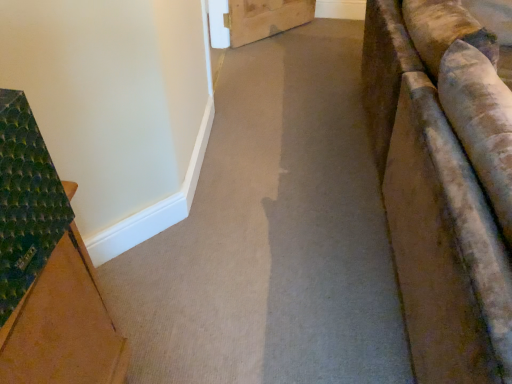
Identify the location of empty space that is ontop of carpet at center (from a real-world perspective). The height and width of the screenshot is (384, 512). (286, 132).